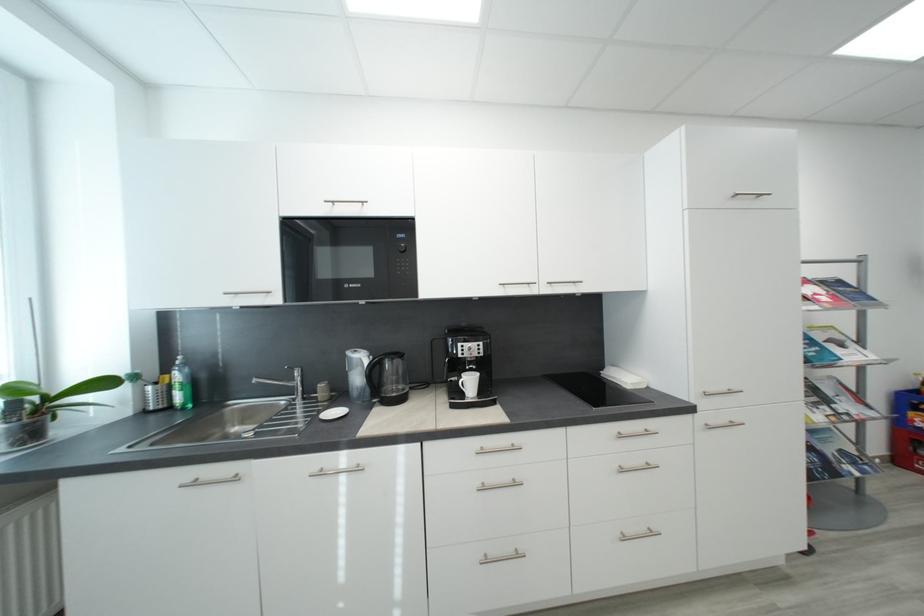
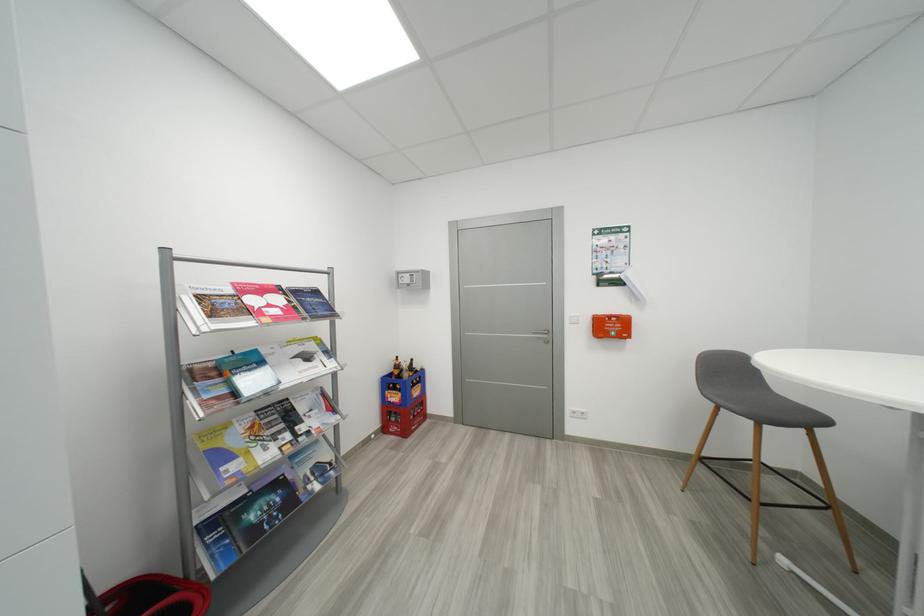
In the second image, find the point that corresponds to (x=833, y=411) in the first image.

(294, 438)